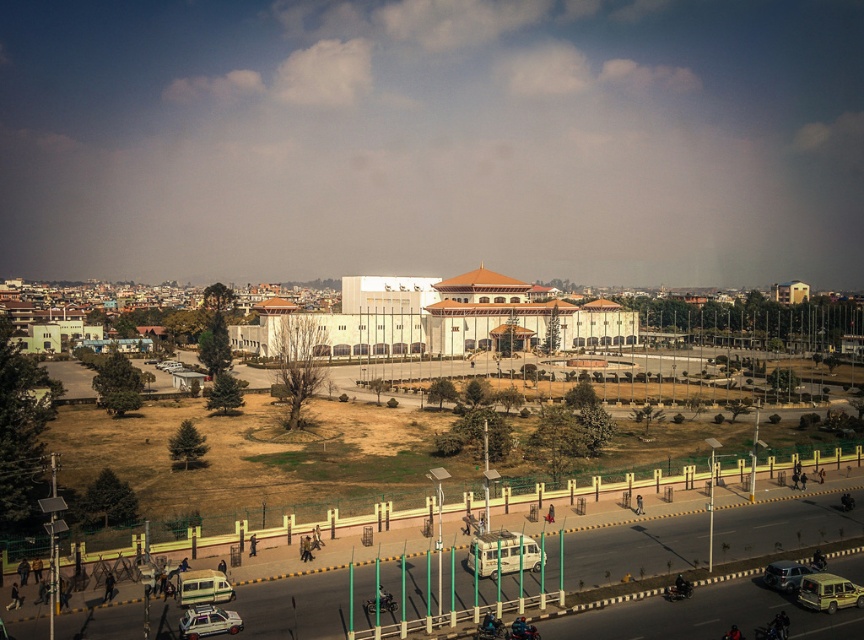
Can you confirm if white glossy building at center is positioned below white matte car at lower left?

No.

Measure the distance from white glossy building at center to white matte car at lower left.

The distance of white glossy building at center from white matte car at lower left is 376.33 feet.

The height and width of the screenshot is (640, 864). In order to click on white glossy building at center in this screenshot , I will do `click(462, 317)`.

The width and height of the screenshot is (864, 640). I want to click on white glossy building at center, so click(x=462, y=317).

Is point (592, 324) more distant than point (178, 604)?

Yes, it is behind point (178, 604).

Does white glossy building at center have a lesser width compared to metallic silver van at lower left?

Incorrect, white glossy building at center's width is not less than metallic silver van at lower left's.

Which is in front, point (268, 326) or point (199, 593)?

Positioned in front is point (199, 593).

Image resolution: width=864 pixels, height=640 pixels. Find the location of `white glossy building at center`. white glossy building at center is located at coordinates (462, 317).

Can you confirm if metallic silver van at lower right is shorter than metallic silver van at lower left?

Incorrect, metallic silver van at lower right's height does not fall short of metallic silver van at lower left's.

Does metallic silver van at lower right appear over metallic silver van at lower left?

Yes, metallic silver van at lower right is above metallic silver van at lower left.

Is point (804, 598) behind point (213, 600)?

No, (804, 598) is closer to viewer.

Identify the location of metallic silver van at lower right. The width and height of the screenshot is (864, 640). (828, 593).